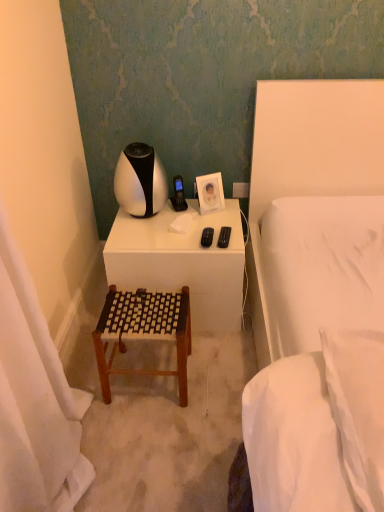
Question: Based on their sizes in the image, would you say white matte desk at center is bigger or smaller than brown woven stool at center?

Choices:
 (A) small
 (B) big

Answer: (B)

Question: Does point (233, 295) appear closer or farther from the camera than point (185, 322)?

Choices:
 (A) closer
 (B) farther

Answer: (B)

Question: Which of these objects is positioned farthest from the white soft pillow at right?

Choices:
 (A) white fabric bed at right
 (B) white fabric curtain at left
 (C) white matte desk at center
 (D) brown woven stool at center
 (E) white glossy table lamp at upper center

Answer: (E)

Question: Which is nearer to the white glossy table lamp at upper center?

Choices:
 (A) white fabric curtain at left
 (B) brown woven stool at center
 (C) white soft pillow at right
 (D) white fabric bed at right
 (E) white matte desk at center

Answer: (E)